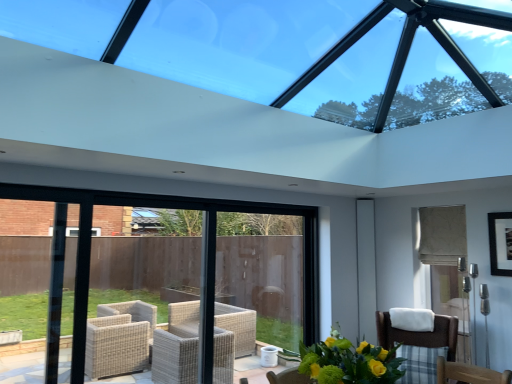
Question: From the image's perspective, is yellow-green bouquet at lower center located above or below black matte picture frame at upper right?

Choices:
 (A) below
 (B) above

Answer: (A)

Question: Visually, is yellow-green bouquet at lower center positioned to the left or to the right of black matte picture frame at upper right?

Choices:
 (A) left
 (B) right

Answer: (A)

Question: Which object is positioned closest to the yellow-green bouquet at lower center?

Choices:
 (A) brown woven chair at lower right
 (B) transparent glass window at upper center
 (C) white glossy screen door at right
 (D) black matte picture frame at upper right

Answer: (A)

Question: Estimate the real-world distances between objects in this image. Which object is farther from the yellow-green bouquet at lower center?

Choices:
 (A) black matte picture frame at upper right
 (B) brown woven chair at lower right
 (C) transparent glass window at upper center
 (D) white glossy screen door at right

Answer: (D)